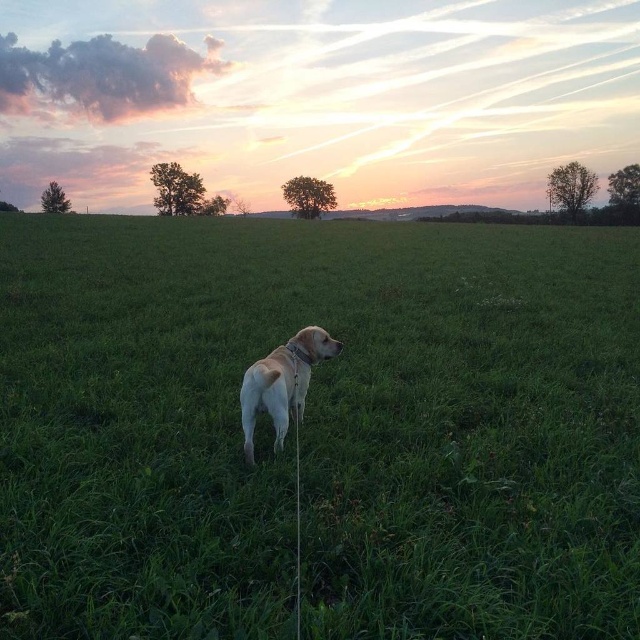
Question: Which point is farther from the camera taking this photo?

Choices:
 (A) (268, 397)
 (B) (589, 339)

Answer: (B)

Question: Does yellow fur dog at center have a smaller size compared to light yellow fur at center?

Choices:
 (A) yes
 (B) no

Answer: (B)

Question: Can you confirm if yellow fur dog at center is wider than light yellow fur at center?

Choices:
 (A) no
 (B) yes

Answer: (B)

Question: Does yellow fur dog at center have a larger size compared to light yellow fur at center?

Choices:
 (A) no
 (B) yes

Answer: (B)

Question: Which of the following is the closest to the observer?

Choices:
 (A) (417, 269)
 (B) (292, 401)

Answer: (B)

Question: Among these points, which one is nearest to the camera?

Choices:
 (A) (262, 364)
 (B) (252, 621)

Answer: (B)